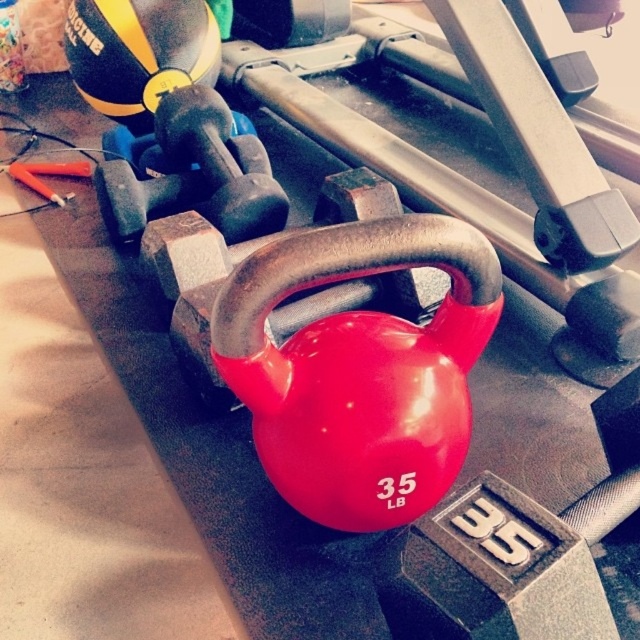
Question: Can you confirm if rubberized red kettlebell at center is positioned to the left of matte black dumbbell at center?

Choices:
 (A) yes
 (B) no

Answer: (B)

Question: Is rubberized red kettlebell at center wider than matte black dumbbell at center?

Choices:
 (A) yes
 (B) no

Answer: (B)

Question: Can you confirm if rubberized red kettlebell at center is positioned to the right of matte black dumbbell at center?

Choices:
 (A) yes
 (B) no

Answer: (A)

Question: Which object appears farthest from the camera in this image?

Choices:
 (A) matte black dumbbell at center
 (B) rubberized red kettlebell at center

Answer: (A)